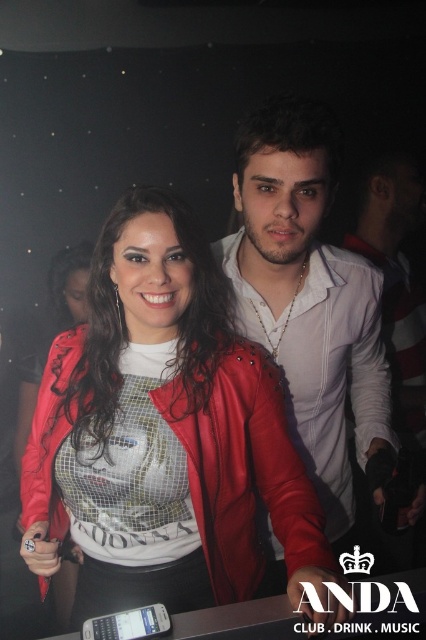
Is shiny red leather jacket at center to the right of matte white shirt at center from the viewer's perspective?

Incorrect, shiny red leather jacket at center is not on the right side of matte white shirt at center.

Does point (58, 371) come in front of point (310, 204)?

That is False.

The width and height of the screenshot is (426, 640). I want to click on shiny red leather jacket at center, so click(x=164, y=435).